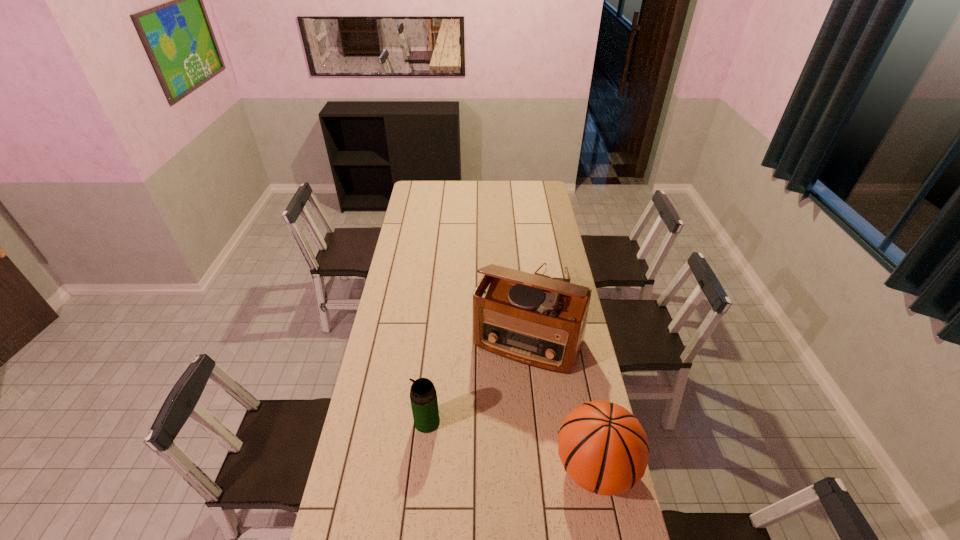
This screenshot has height=540, width=960. In order to click on the leftmost object in this screenshot , I will do `click(423, 396)`.

Where is `basketball`? basketball is located at coordinates (603, 448).

You are a GUI agent. You are given a task and a screenshot of the screen. Output one action in this format:
    pyautogui.click(x=<x>, y=<y>)
    Task: Click on the radio receiver
    
    Given the screenshot: What is the action you would take?
    pyautogui.click(x=538, y=321)

Identify the location of the tallest object. (538, 321).

Find the location of a particular element. This screenshot has width=960, height=540. the shortest object is located at coordinates (561, 279).

The width and height of the screenshot is (960, 540). What are the coordinates of `sunglasses` in the screenshot? It's located at (561, 279).

Locate an element on the screen. Image resolution: width=960 pixels, height=540 pixels. blank area located from the spout of the leftmost object is located at coordinates (387, 422).

The image size is (960, 540). What are the coordinates of `free region located 0.160m from the spout of the leftmost object` in the screenshot? It's located at (370, 422).

Identify the location of vacant area located 0.200m from the spout of the leftmost object. (359, 422).

What are the coordinates of `free space located on the back of the basketball` in the screenshot? It's located at (572, 352).